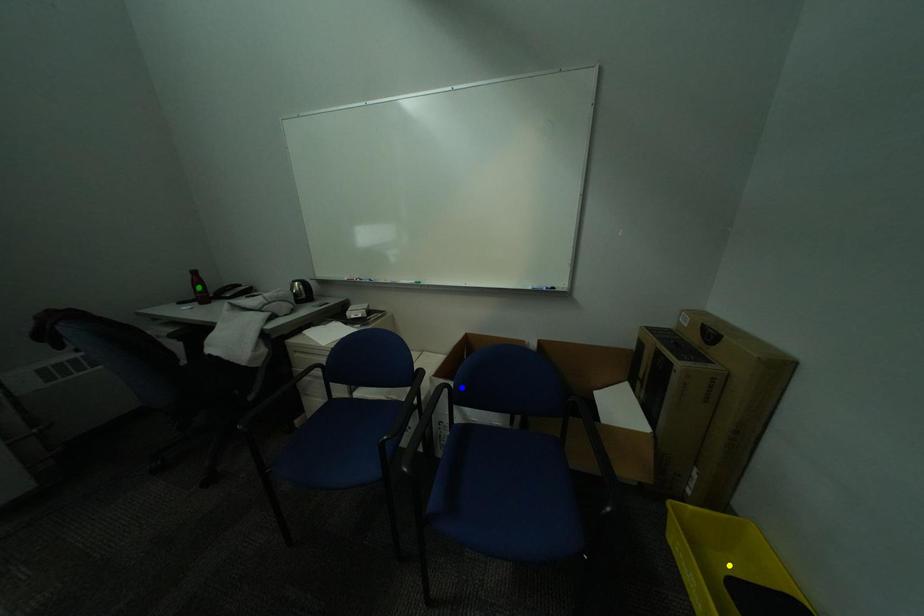
Order these from nearest to farthest:
1. blue point
2. yellow point
3. green point

1. yellow point
2. blue point
3. green point